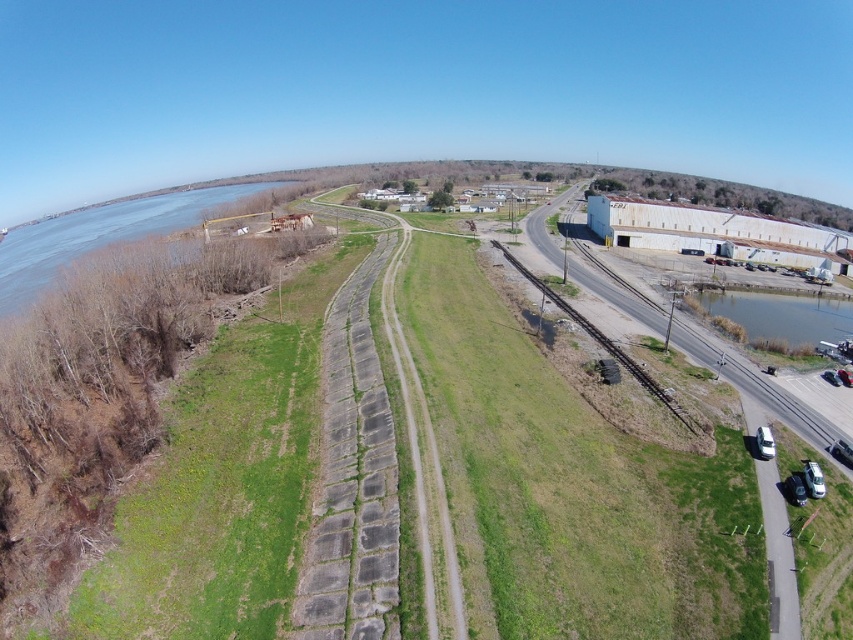
Question: Which point is farther from the camera taking this photo?

Choices:
 (A) (524, 275)
 (B) (148, 209)
 (C) (759, 310)

Answer: (B)

Question: Which object appears farthest from the camera in this image?

Choices:
 (A) rusty metal train track at lower right
 (B) clear water at lower right
 (C) blue water at left

Answer: (C)

Question: Does blue water at left have a larger size compared to rusty metal train track at lower right?

Choices:
 (A) yes
 (B) no

Answer: (A)

Question: Can you confirm if blue water at left is smaller than clear water at lower right?

Choices:
 (A) no
 (B) yes

Answer: (A)

Question: Does blue water at left have a lesser width compared to rusty metal train track at lower right?

Choices:
 (A) yes
 (B) no

Answer: (B)

Question: Which of these objects is positioned farthest from the rusty metal train track at lower right?

Choices:
 (A) clear water at lower right
 (B) blue water at left

Answer: (B)